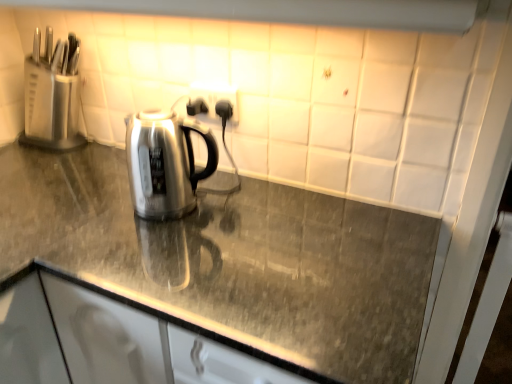
Question: Is black plastic outlet at center thinner than polished granite countertop at center?

Choices:
 (A) no
 (B) yes

Answer: (B)

Question: Would you consider black plastic outlet at center to be distant from polished granite countertop at center?

Choices:
 (A) no
 (B) yes

Answer: (A)

Question: Does black plastic outlet at center have a greater height compared to polished granite countertop at center?

Choices:
 (A) yes
 (B) no

Answer: (B)

Question: Is black plastic outlet at center closer to camera compared to polished granite countertop at center?

Choices:
 (A) yes
 (B) no

Answer: (B)

Question: Is black plastic outlet at center shorter than polished granite countertop at center?

Choices:
 (A) no
 (B) yes

Answer: (B)

Question: From a real-world perspective, is black plastic outlet at center below polished granite countertop at center?

Choices:
 (A) no
 (B) yes

Answer: (A)

Question: Can you confirm if polished granite countertop at center is taller than black plastic outlet at center?

Choices:
 (A) yes
 (B) no

Answer: (A)

Question: Is polished granite countertop at center next to black plastic outlet at center and touching it?

Choices:
 (A) yes
 (B) no

Answer: (B)

Question: Can you confirm if polished granite countertop at center is thinner than black plastic outlet at center?

Choices:
 (A) yes
 (B) no

Answer: (B)

Question: Is polished granite countertop at center not inside black plastic outlet at center?

Choices:
 (A) yes
 (B) no

Answer: (A)

Question: From the image's perspective, would you say polished granite countertop at center is shown under black plastic outlet at center?

Choices:
 (A) yes
 (B) no

Answer: (A)

Question: From a real-world perspective, is polished granite countertop at center located beneath black plastic outlet at center?

Choices:
 (A) yes
 (B) no

Answer: (A)

Question: Would you consider black plastic outlet at center to be distant from white glossy exhaust hood at upper center?

Choices:
 (A) yes
 (B) no

Answer: (B)